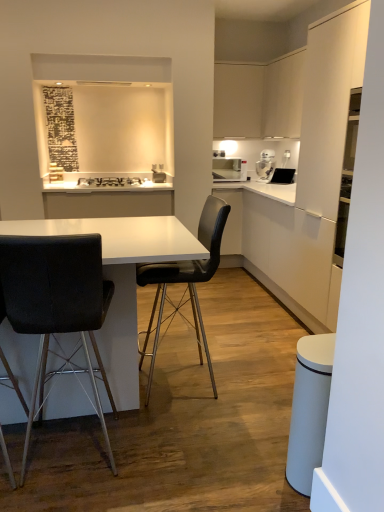
Question: Would you consider white matte cabinet at right to be distant from black matte stove at upper center?

Choices:
 (A) no
 (B) yes

Answer: (B)

Question: From the image's perspective, does white matte cabinet at right appear higher than black matte stove at upper center?

Choices:
 (A) no
 (B) yes

Answer: (A)

Question: Is white matte cabinet at right positioned with its back to black matte stove at upper center?

Choices:
 (A) no
 (B) yes

Answer: (A)

Question: Could you tell me if white matte cabinet at right is turned towards black matte stove at upper center?

Choices:
 (A) yes
 (B) no

Answer: (A)

Question: Considering the relative sizes of white matte cabinet at right and black matte stove at upper center in the image provided, is white matte cabinet at right thinner than black matte stove at upper center?

Choices:
 (A) yes
 (B) no

Answer: (B)

Question: From a real-world perspective, is white glossy coffee machine at upper right above or below white matte cabinet at right?

Choices:
 (A) above
 (B) below

Answer: (A)

Question: In terms of size, does white glossy coffee machine at upper right appear bigger or smaller than white matte cabinet at right?

Choices:
 (A) big
 (B) small

Answer: (B)

Question: Is white glossy coffee machine at upper right taller or shorter than white matte cabinet at right?

Choices:
 (A) short
 (B) tall

Answer: (A)

Question: In terms of width, does white glossy coffee machine at upper right look wider or thinner when compared to white matte cabinet at right?

Choices:
 (A) wide
 (B) thin

Answer: (B)

Question: Is point (294, 298) positioned closer to the camera than point (102, 347)?

Choices:
 (A) farther
 (B) closer

Answer: (A)

Question: From the image's perspective, is white matte cabinet at right above or below white glossy table at center?

Choices:
 (A) above
 (B) below

Answer: (A)

Question: From a real-world perspective, relative to white glossy table at center, is white matte cabinet at right vertically above or below?

Choices:
 (A) above
 (B) below

Answer: (A)

Question: Is white matte cabinet at right to the left or to the right of white glossy table at center in the image?

Choices:
 (A) right
 (B) left

Answer: (A)

Question: Is white glossy coffee machine at upper right situated inside matte white microwave at upper right or outside?

Choices:
 (A) inside
 (B) outside

Answer: (B)

Question: Based on their sizes in the image, would you say white glossy coffee machine at upper right is bigger or smaller than matte white microwave at upper right?

Choices:
 (A) small
 (B) big

Answer: (A)